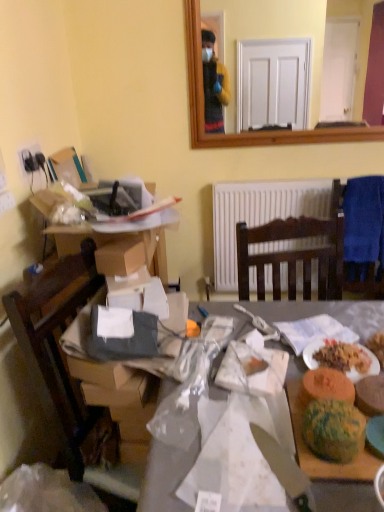
Question: Is multicolored plastic watermelon at lower right in front of or behind cardboard box at left, which is counted as the 2th desk, starting from the bottom, in the image?

Choices:
 (A) behind
 (B) front

Answer: (B)

Question: From the image's perspective, is multicolored plastic watermelon at lower right above or below cardboard box at left, which is counted as the 2th desk, starting from the bottom?

Choices:
 (A) above
 (B) below

Answer: (B)

Question: Which object is the closest to the green textured cake at lower right, the first food from the right?

Choices:
 (A) silver metallic knife at center
 (B) translucent plastic bag at center, acting as the second desk starting from the top
 (C) green textured bread at lower right, which is counted as the 3th food, starting from the right
 (D) white paper plate at lower right
 (E) cardboard box at left, which is counted as the 2th desk, starting from the bottom

Answer: (C)

Question: Considering the real-world distances, which object is farthest from the white paper at center?

Choices:
 (A) white paper plate at lower right
 (B) blue fabric chair at right
 (C) green textured bread at lower right, which is counted as the 3th food, starting from the right
 (D) silver metallic knife at center
 (E) green textured bread at right, which is counted as the second food, starting from the left

Answer: (B)